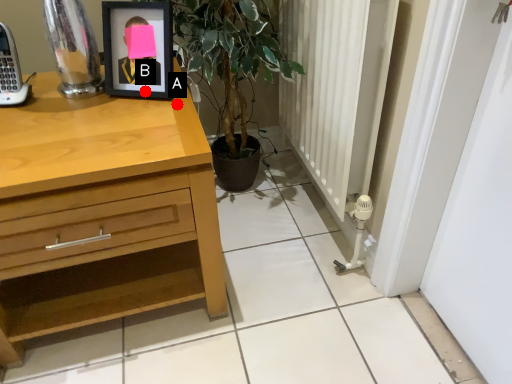
Question: Two points are circled on the image, labeled by A and B beside each circle. Which point appears closest to the camera in this image?

Choices:
 (A) A is closer
 (B) B is closer

Answer: (A)